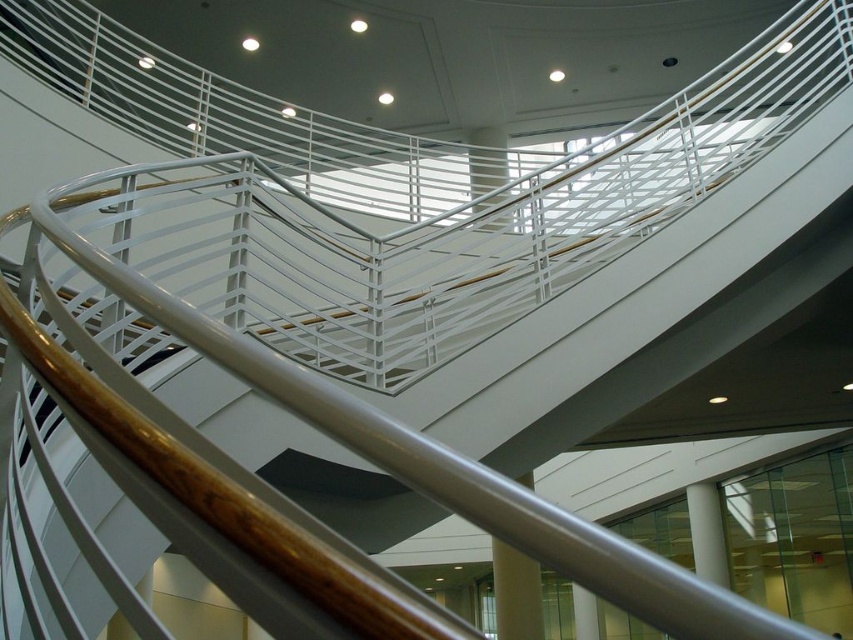
Looking at this image, can you confirm if satin silver pole at center is smaller than white metal/texture pillar at upper center?

Yes.

Which is in front, point (515, 618) or point (486, 129)?

Positioned in front is point (515, 618).

Locate an element on the screen. The height and width of the screenshot is (640, 853). satin silver pole at center is located at coordinates (515, 593).